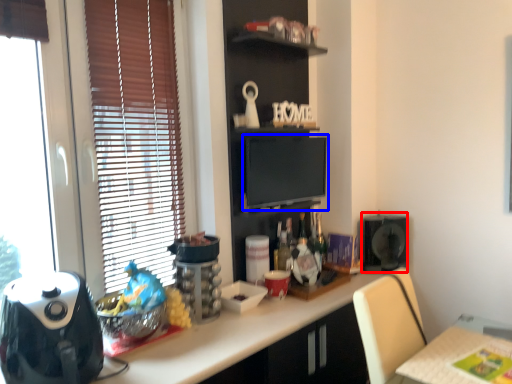
Question: Which of the following is the closest to the observer, appliance (highlighted by a red box) or computer monitor (highlighted by a blue box)?

Choices:
 (A) appliance
 (B) computer monitor

Answer: (B)